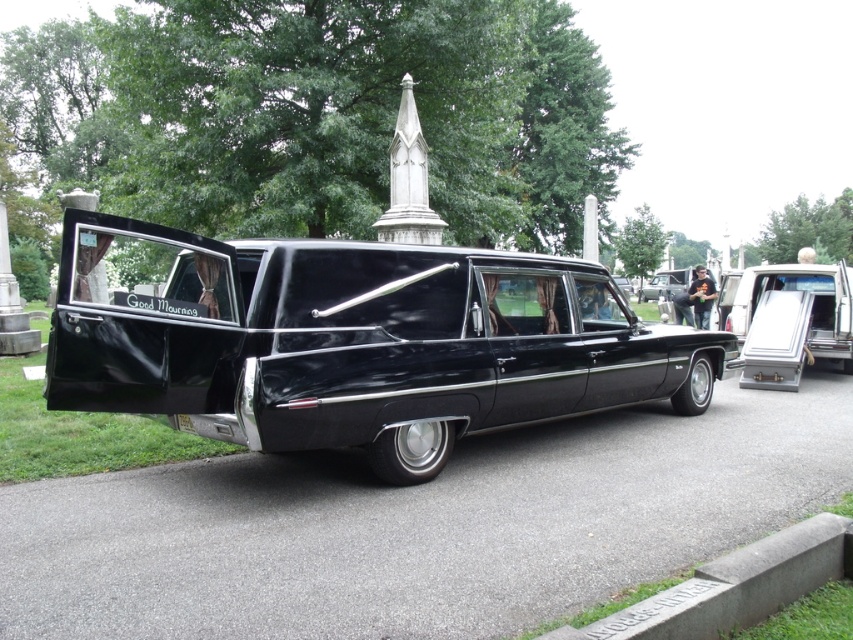
Question: Where is black glossy hearse at center located in relation to metallic silver casket at center in the image?

Choices:
 (A) right
 (B) left

Answer: (B)

Question: Is black glossy hearse at center below metallic silver casket at center?

Choices:
 (A) no
 (B) yes

Answer: (B)

Question: Does black glossy hearse at center have a greater width compared to metallic silver casket at center?

Choices:
 (A) yes
 (B) no

Answer: (B)